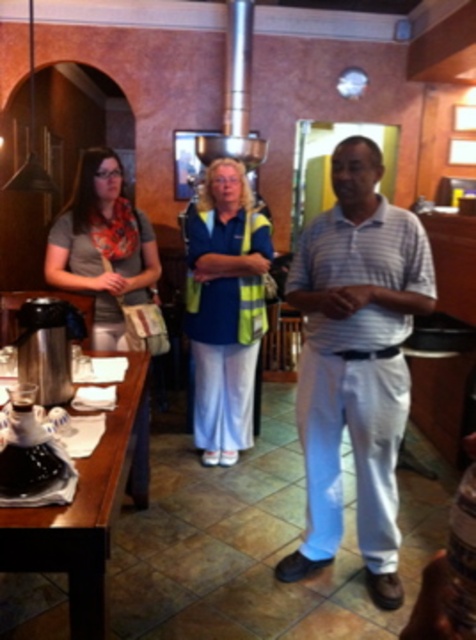
Can you confirm if white striped polo shirt at center is taller than matte gray scarf at left?

Yes, white striped polo shirt at center is taller than matte gray scarf at left.

Is white striped polo shirt at center positioned at the back of matte gray scarf at left?

That is False.

Identify the location of white striped polo shirt at center. The image size is (476, 640). (356, 362).

This screenshot has height=640, width=476. In order to click on white striped polo shirt at center in this screenshot , I will do `click(356, 362)`.

Is blue reflective vest at center to the left of matte gray scarf at left from the viewer's perspective?

Incorrect, blue reflective vest at center is not on the left side of matte gray scarf at left.

Can you confirm if blue reflective vest at center is positioned above matte gray scarf at left?

No.

Does point (225, 449) come closer to viewer compared to point (116, 160)?

No, it is behind (116, 160).

Where is `blue reflective vest at center`? blue reflective vest at center is located at coordinates (225, 308).

Which is behind, point (416, 246) or point (96, 566)?

Point (416, 246)

Can you confirm if white striped polo shirt at center is positioned below brown wood table at lower left?

Actually, white striped polo shirt at center is above brown wood table at lower left.

Does point (306, 280) lie behind point (71, 557)?

Yes.

You are a GUI agent. You are given a task and a screenshot of the screen. Output one action in this format:
    pyautogui.click(x=<x>, y=<y>)
    Task: Click on the white striped polo shirt at center
    The height and width of the screenshot is (640, 476).
    Given the screenshot: What is the action you would take?
    pyautogui.click(x=356, y=362)